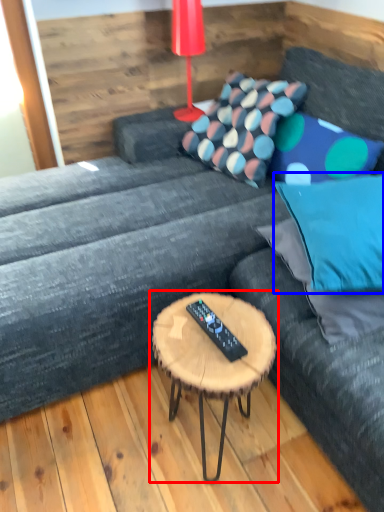
Question: Which object is closer to the camera taking this photo, coffee table (highlighted by a red box) or pillow (highlighted by a blue box)?

Choices:
 (A) coffee table
 (B) pillow

Answer: (A)